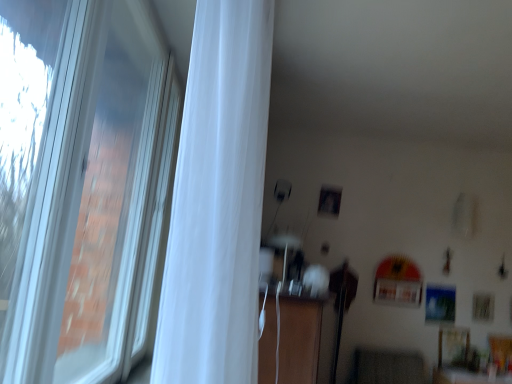
Question: Choose the correct answer: Is white sheer curtain at left inside white plastic window at left or outside it?

Choices:
 (A) inside
 (B) outside

Answer: (B)

Question: Is white sheer curtain at left to the left or to the right of white plastic window at left in the image?

Choices:
 (A) left
 (B) right

Answer: (B)

Question: Based on their relative distances, which object is nearer to the wooden dresser at center?

Choices:
 (A) white sheer curtain at left
 (B) white plastic window at left

Answer: (B)

Question: Which is nearer to the white sheer curtain at left?

Choices:
 (A) white plastic window at left
 (B) wooden dresser at center

Answer: (A)